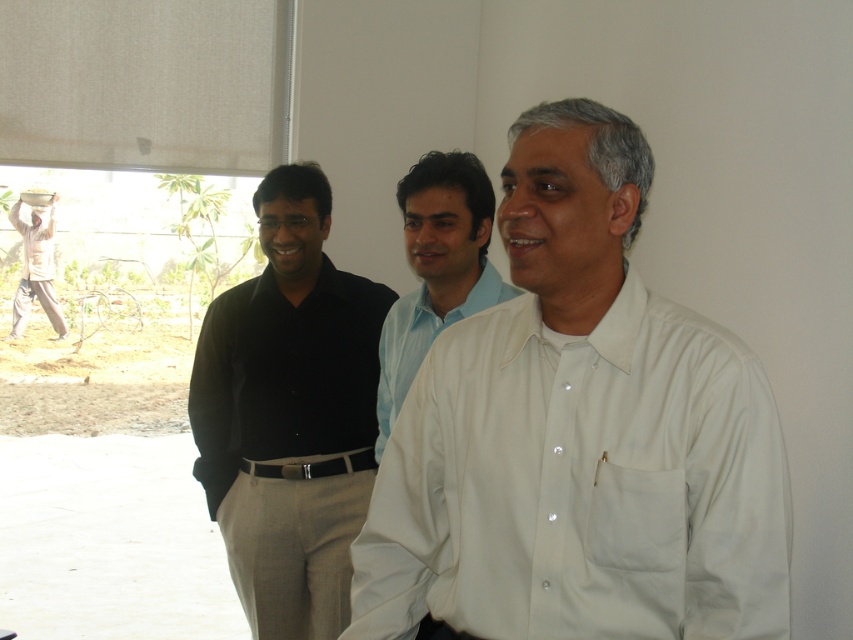
Is white smooth shirt at center taller than light beige cotton shirt at left?

No.

Identify the location of white smooth shirt at center. Image resolution: width=853 pixels, height=640 pixels. (579, 435).

Does white smooth shirt at center come in front of light blue cotton shirt at center?

Yes.

Who is positioned more to the right, white smooth shirt at center or light blue cotton shirt at center?

white smooth shirt at center is more to the right.

Identify the location of white smooth shirt at center. (579, 435).

In order to click on white smooth shirt at center in this screenshot , I will do `click(579, 435)`.

Can you confirm if white smooth shirt at center is smaller than black smooth shirt at center?

Yes.

Does point (428, 406) lie behind point (221, 513)?

No, it is not.

Does point (567, 150) come in front of point (277, 396)?

Yes, point (567, 150) is closer to viewer.

In order to click on white smooth shirt at center in this screenshot , I will do `click(579, 435)`.